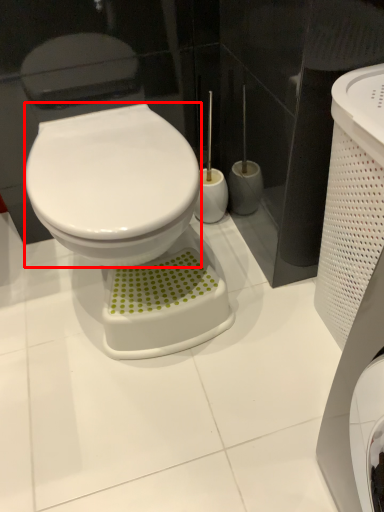
Question: From the image's perspective, what is the correct spatial positioning of bidet (annotated by the red box) in reference to porcelain?

Choices:
 (A) above
 (B) below

Answer: (A)